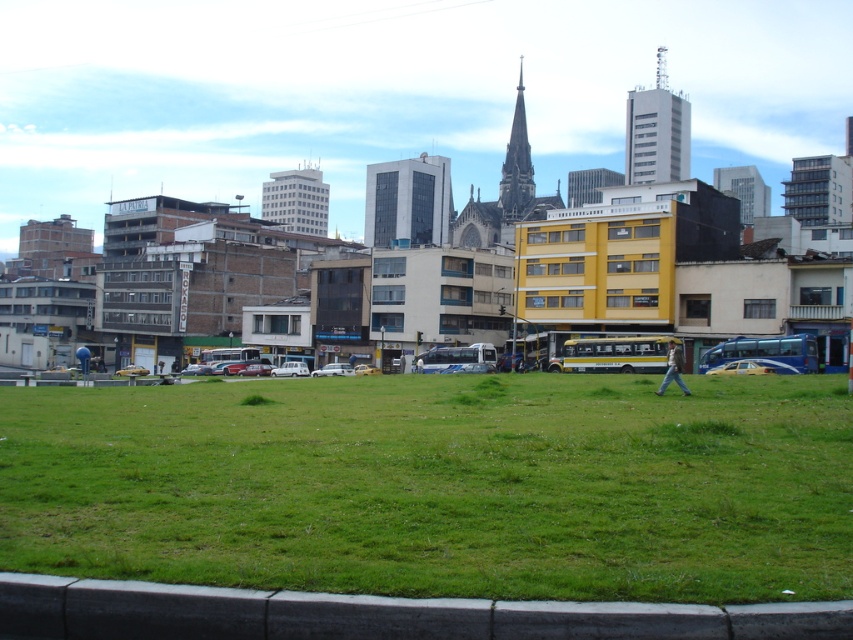
Where is `white glossy bus at center`? The image size is (853, 640). white glossy bus at center is located at coordinates (457, 358).

Which of these two, white glossy bus at center or white metallic bus at center, stands shorter?

Standing shorter between the two is white metallic bus at center.

Image resolution: width=853 pixels, height=640 pixels. Describe the element at coordinates (457, 358) in the screenshot. I see `white glossy bus at center` at that location.

The height and width of the screenshot is (640, 853). I want to click on white glossy bus at center, so click(x=457, y=358).

Which is in front, point (509, 145) or point (251, 353)?

Point (251, 353) is more forward.

Is point (527, 182) positioned before point (219, 355)?

No, it is behind (219, 355).

Locate an element on the screen. The width and height of the screenshot is (853, 640). dark gray stone spire at center is located at coordinates (517, 166).

Is white glossy bus at center to the right of white matte car at center from the viewer's perspective?

Correct, you'll find white glossy bus at center to the right of white matte car at center.

Is white glossy bus at center below white matte car at center?

Incorrect, white glossy bus at center is not positioned below white matte car at center.

Consider the image. Who is more distant from viewer, (438, 356) or (282, 372)?

The point (282, 372) is more distant.

At what (x,y) coordinates should I click in order to perform the action: click on white glossy bus at center. Please return your answer as a coordinate pair (x, y). The height and width of the screenshot is (640, 853). Looking at the image, I should click on (457, 358).